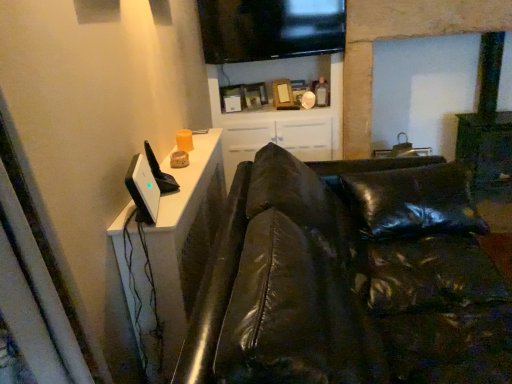
The width and height of the screenshot is (512, 384). Find the location of `white glossy dresser at upper left`. white glossy dresser at upper left is located at coordinates pyautogui.click(x=170, y=255).

This screenshot has width=512, height=384. In order to click on white glossy dresser at upper left in this screenshot , I will do point(170,255).

Which of these two, flat screen tv at upper center or black leather couch at left, is bigger?

black leather couch at left is bigger.

How many degrees apart are the facing directions of flat screen tv at upper center and black leather couch at left?

The angular difference between flat screen tv at upper center and black leather couch at left is 88.3 degrees.

At what (x,y) coordinates should I click in order to perform the action: click on television that appears above the black leather couch at left (from the image's perspective). Please return your answer as a coordinate pair (x, y). Looking at the image, I should click on (270, 29).

Considering the sizes of objects flat screen tv at upper center and black leather couch at left in the image provided, who is wider, flat screen tv at upper center or black leather couch at left?

Wider between the two is black leather couch at left.

Is white glossy cabinet at upper center placed right next to flat screen tv at upper center?

No, white glossy cabinet at upper center is not in contact with flat screen tv at upper center.

Considering their positions, is white glossy cabinet at upper center located in front of or behind flat screen tv at upper center?

white glossy cabinet at upper center is behind flat screen tv at upper center.

Is white glossy cabinet at upper center at the right side of flat screen tv at upper center?

Indeed, white glossy cabinet at upper center is positioned on the right side of flat screen tv at upper center.

Can we say white glossy cabinet at upper center lies outside flat screen tv at upper center?

Yes, white glossy cabinet at upper center is outside of flat screen tv at upper center.

Is flat screen tv at upper center at the left side of white glossy cabinet at upper center?

Indeed, flat screen tv at upper center is positioned on the left side of white glossy cabinet at upper center.

This screenshot has width=512, height=384. I want to click on entertainment center on the right of flat screen tv at upper center, so click(x=278, y=112).

In the scene shown: Would you say flat screen tv at upper center contains white glossy cabinet at upper center?

That's incorrect, white glossy cabinet at upper center is not inside flat screen tv at upper center.

From a real-world perspective, is flat screen tv at upper center positioned above or below white glossy cabinet at upper center?

Clearly, from a real-world perspective, flat screen tv at upper center is above white glossy cabinet at upper center.

What are the coordinates of `television above the black leather couch at left (from a real-world perspective)` in the screenshot? It's located at (270, 29).

Can you confirm if black leather couch at left is shorter than flat screen tv at upper center?

In fact, black leather couch at left may be taller than flat screen tv at upper center.

From a real-world perspective, relative to flat screen tv at upper center, is black leather couch at left vertically above or below?

black leather couch at left is below flat screen tv at upper center.

Is point (338, 336) in front of point (330, 24)?

Yes, it is in front of point (330, 24).

Is black leather couch at left not inside white glossy cabinet at upper center?

Indeed, black leather couch at left is completely outside white glossy cabinet at upper center.

Is black leather couch at left behind white glossy cabinet at upper center?

No, it is not.

Is point (503, 382) positioned after point (335, 102)?

That is False.

Find the location of a particular element. The height and width of the screenshot is (384, 512). studio couch that is on the right side of white glossy cabinet at upper center is located at coordinates (349, 279).

From the picture: Considering the sizes of objects flat screen tv at upper center and white glossy dresser at upper left in the image provided, who is shorter, flat screen tv at upper center or white glossy dresser at upper left?

With less height is flat screen tv at upper center.

Which object is more forward, flat screen tv at upper center or white glossy dresser at upper left?

white glossy dresser at upper left is more forward.

From a real-world perspective, is flat screen tv at upper center positioned under white glossy dresser at upper left based on gravity?

No, from a real-world perspective, flat screen tv at upper center is not beneath white glossy dresser at upper left.

Which object is positioned more to the left, flat screen tv at upper center or white glossy dresser at upper left?

Positioned to the left is white glossy dresser at upper left.

Is white glossy cabinet at upper center wider than black leather couch at left?

Incorrect, the width of white glossy cabinet at upper center does not surpass that of black leather couch at left.

Between white glossy cabinet at upper center and black leather couch at left, which one is positioned in front?

black leather couch at left.

Is black leather couch at left located within white glossy cabinet at upper center?

No, black leather couch at left is not surrounded by white glossy cabinet at upper center.

In order to click on studio couch that is in front of the flat screen tv at upper center in this screenshot , I will do `click(349, 279)`.

The width and height of the screenshot is (512, 384). I want to click on entertainment center below the flat screen tv at upper center (from the image's perspective), so click(x=278, y=112).

When comparing their distances from flat screen tv at upper center, does white glossy cabinet at upper center or black leather couch at left seem further?

black leather couch at left.

From the image, which object appears to be farther from flat screen tv at upper center, white glossy cabinet at upper center or white glossy dresser at upper left?

Among the two, white glossy dresser at upper left is located further to flat screen tv at upper center.

Estimate the real-world distances between objects in this image. Which object is further from flat screen tv at upper center, black leather couch at left or white glossy dresser at upper left?

Among the two, black leather couch at left is located further to flat screen tv at upper center.

Considering their positions, is white glossy dresser at upper left positioned further to flat screen tv at upper center than white glossy cabinet at upper center?

Based on the image, white glossy dresser at upper left appears to be further to flat screen tv at upper center.

From the image, which object appears to be farther from white glossy dresser at upper left, white glossy cabinet at upper center or black leather couch at left?

white glossy cabinet at upper center is further to white glossy dresser at upper left.

From the image, which object appears to be nearer to black leather couch at left, flat screen tv at upper center or white glossy dresser at upper left?

Based on the image, white glossy dresser at upper left appears to be nearer to black leather couch at left.

Which object lies nearer to the anchor point white glossy dresser at upper left, white glossy cabinet at upper center or flat screen tv at upper center?

flat screen tv at upper center is positioned closer to the anchor white glossy dresser at upper left.

Considering their positions, is black leather couch at left positioned closer to flat screen tv at upper center than white glossy cabinet at upper center?

white glossy cabinet at upper center is positioned closer to the anchor flat screen tv at upper center.

Where is `dresser between black leather couch at left and flat screen tv at upper center from front to back`? dresser between black leather couch at left and flat screen tv at upper center from front to back is located at coordinates (170, 255).

Locate an element on the screen. The width and height of the screenshot is (512, 384). television positioned between white glossy dresser at upper left and white glossy cabinet at upper center from near to far is located at coordinates (270, 29).

Identify the location of television between black leather couch at left and white glossy cabinet at upper center along the z-axis. (270, 29).

This screenshot has width=512, height=384. What are the coordinates of `dresser between black leather couch at left and white glossy cabinet at upper center from front to back` in the screenshot? It's located at (170, 255).